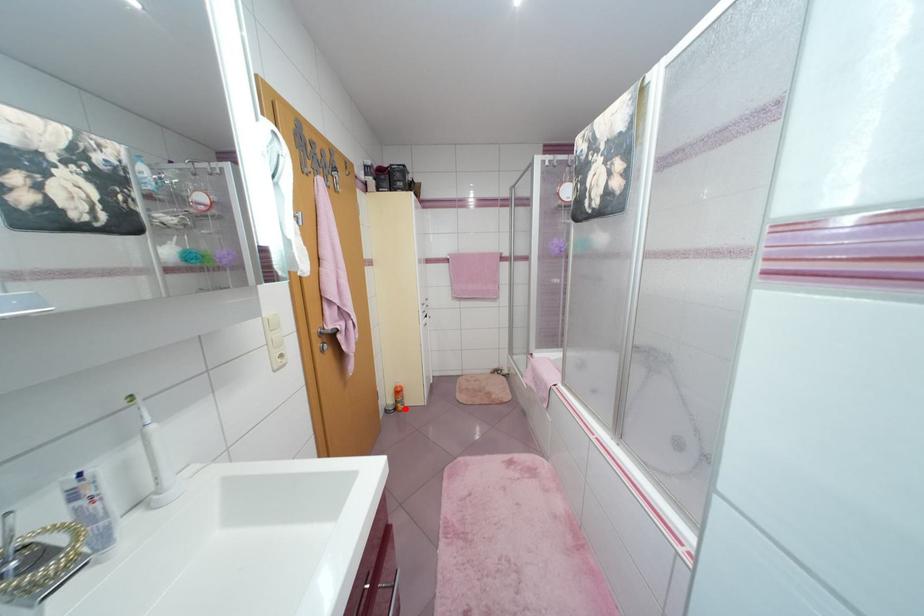
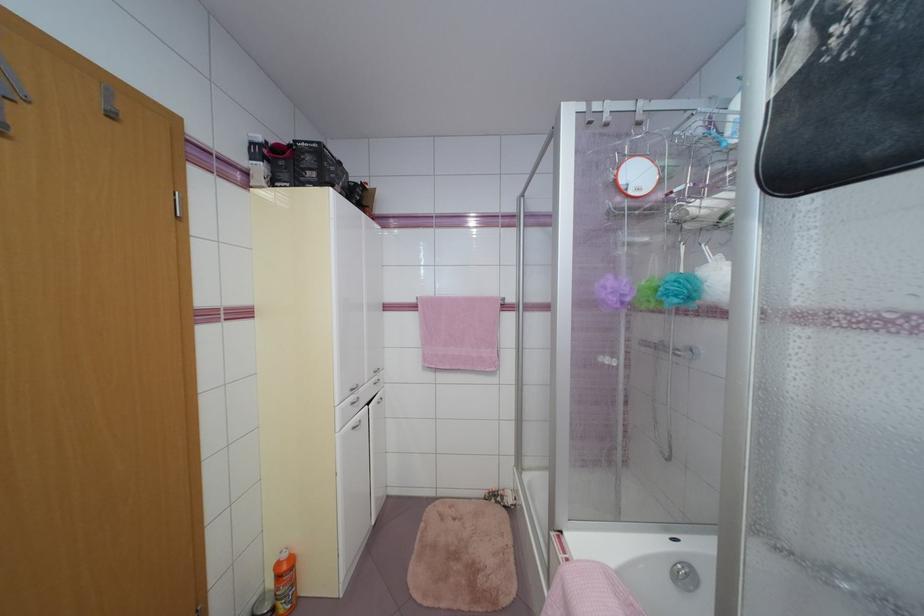
Where in the second image is the point corresponding to the highlighted location from the first image?

(287, 610)